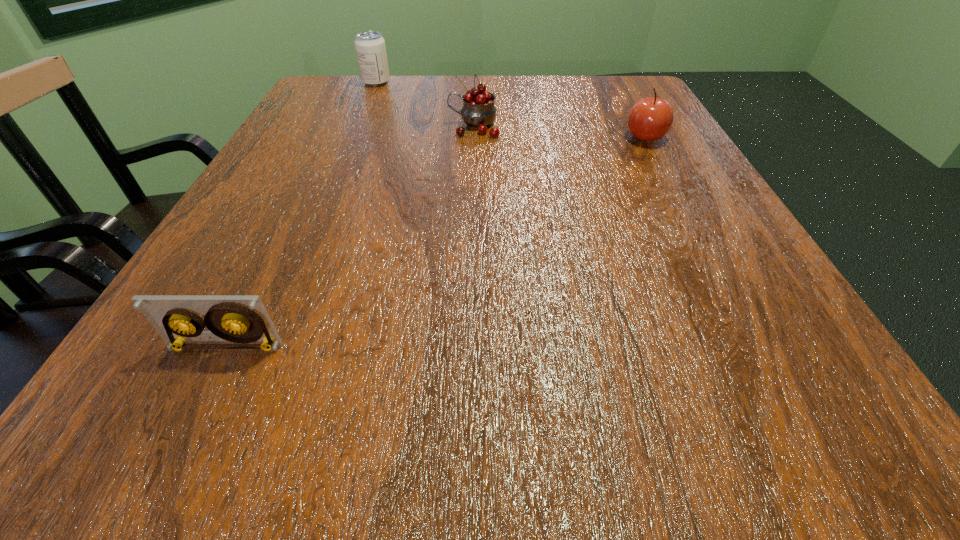
You are a GUI agent. You are given a task and a screenshot of the screen. Output one action in this format:
    pyautogui.click(x=<x>, y=<y>)
    Task: Click on the soda can
    The width and height of the screenshot is (960, 540).
    Given the screenshot: What is the action you would take?
    pyautogui.click(x=370, y=47)

The width and height of the screenshot is (960, 540). What are the coordinates of `the third object from left to right` in the screenshot? It's located at (478, 111).

Find the location of a particular element. This screenshot has width=960, height=540. the rightmost object is located at coordinates (649, 119).

Identify the location of videotape. This screenshot has height=540, width=960. (243, 319).

Identify the location of free region located 0.180m on the right of the farthest object. (463, 82).

What are the coordinates of `blank space located on the handle side of the cherry` in the screenshot? It's located at (333, 126).

At what (x,y) coordinates should I click in order to perform the action: click on free spot located on the handle side of the cherry. Please return your answer as a coordinate pair (x, y). Looking at the image, I should click on (338, 126).

Locate an element on the screen. This screenshot has width=960, height=540. vacant space located on the handle side of the cherry is located at coordinates (314, 126).

This screenshot has width=960, height=540. Identify the location of free location located 0.050m on the back of the apple. (634, 117).

You are a GUI agent. You are given a task and a screenshot of the screen. Output one action in this format:
    pyautogui.click(x=<x>, y=<y>)
    Task: Click on the vacant space located 0.080m at the front of the videotape with visible reels
    The width and height of the screenshot is (960, 540).
    Given the screenshot: What is the action you would take?
    pyautogui.click(x=192, y=416)